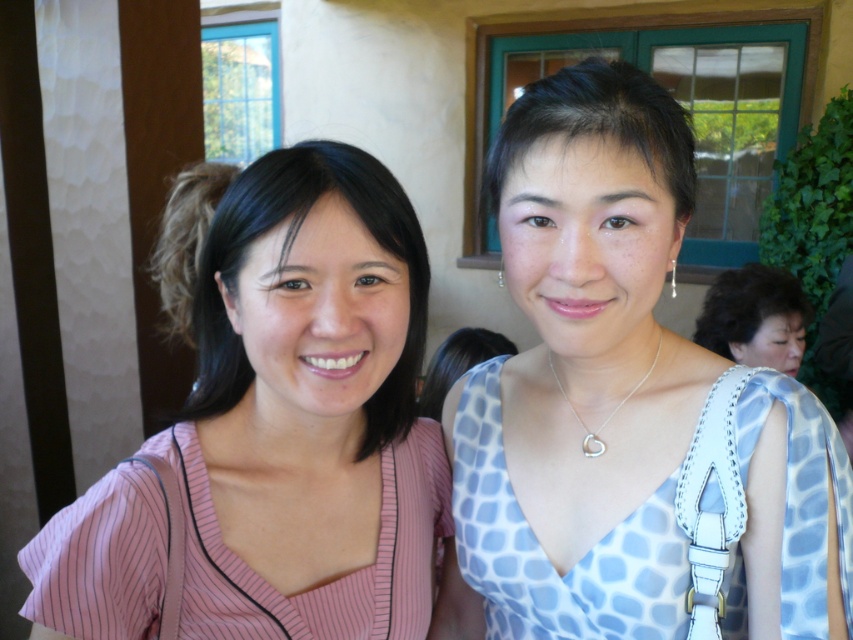
You are a photographer taking a picture of two friends. The light blue printed dress at center and the pink striped blouse at left are in the frame. Which clothing item is positioned to the right of the other?

The light blue printed dress at center is to the right of the pink striped blouse at left according to the description.

You are standing in a room and want to take a photo of the two people in front of you. The camera you have can only focus on objects within 30 inches. Is the point at coordinate point (x=741, y=376) within the camera focus range?

The distance between point (x=741, y=376) and the viewer is 29.46 inches, which is within the camera focus range of 30 inches. The camera can focus on the point at point (x=741, y=376).

You are a photographer trying to capture a clear shot of both the light blue printed dress at center and the pink striped blouse at left. Since you want to focus on the thinner garment, which one should you adjust your camera settings for?

The light blue printed dress at center is thinner than the pink striped blouse at left, so you should adjust your camera settings to focus on the light blue printed dress at center.